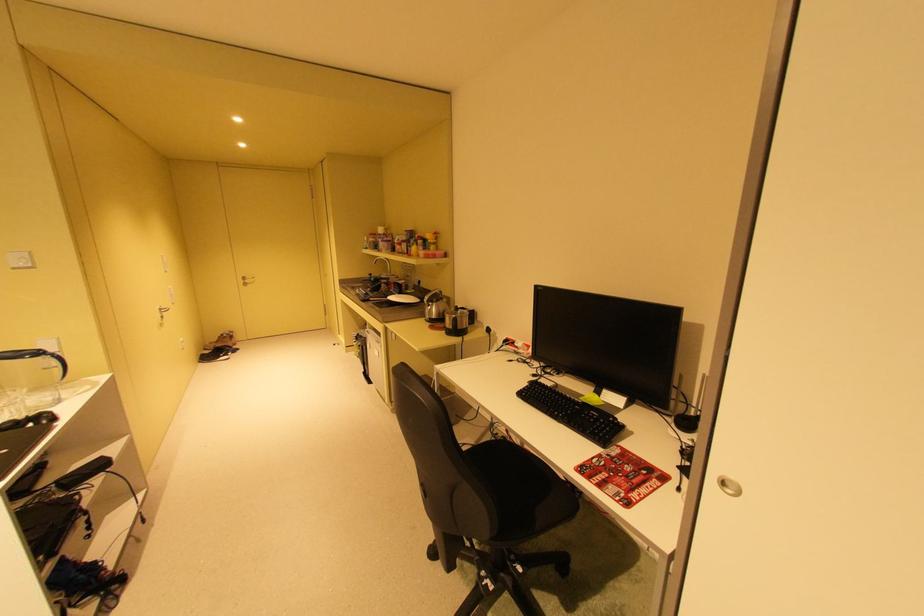
The image size is (924, 616). Identify the location of glass cup. (13, 403).